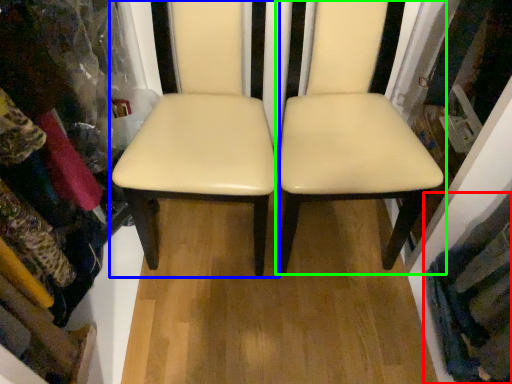
Question: Which is nearer to the clothing (highlighted by a red box)? chair (highlighted by a blue box) or chair (highlighted by a green box).

Choices:
 (A) chair
 (B) chair

Answer: (B)